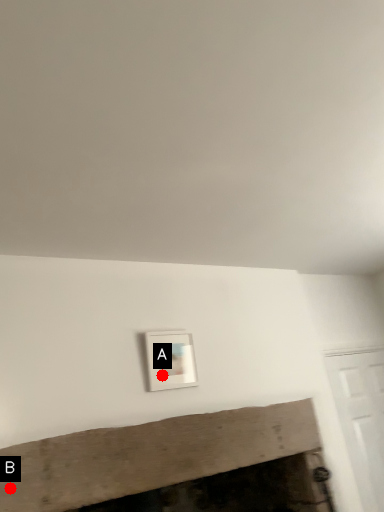
Question: Two points are circled on the image, labeled by A and B beside each circle. Which point is closer to the camera?

Choices:
 (A) A is closer
 (B) B is closer

Answer: (B)